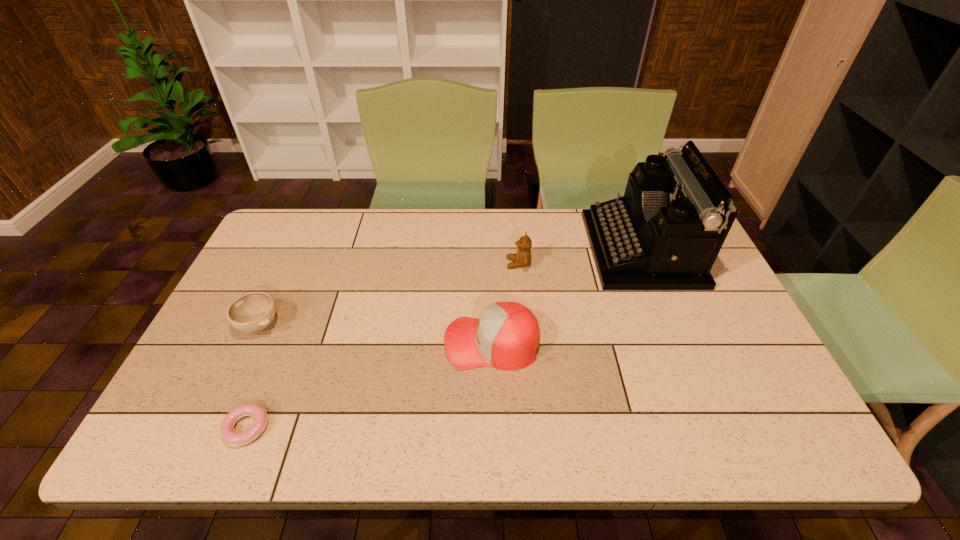
You are a GUI agent. You are given a task and a screenshot of the screen. Output one action in this format:
    pyautogui.click(x=<x>, y=<y>)
    Task: Click on the object that is positioned at the near edge
    
    Given the screenshot: What is the action you would take?
    pyautogui.click(x=228, y=435)

Image resolution: width=960 pixels, height=540 pixels. What are the coordinates of `bowl located in the left edge section of the desktop` in the screenshot? It's located at pyautogui.click(x=252, y=312).

Image resolution: width=960 pixels, height=540 pixels. In order to click on doughnut located in the left edge section of the desktop in this screenshot , I will do `click(228, 435)`.

The width and height of the screenshot is (960, 540). I want to click on object at the right edge, so click(x=665, y=233).

Find the location of `object situated at the near left corner`. object situated at the near left corner is located at coordinates (228, 435).

The width and height of the screenshot is (960, 540). I want to click on object that is positioned at the far right corner, so click(x=665, y=233).

The height and width of the screenshot is (540, 960). In order to click on free region at the far edge in this screenshot , I will do `click(486, 222)`.

The image size is (960, 540). In order to click on vacant region at the near edge of the desktop in this screenshot , I will do `click(325, 430)`.

This screenshot has height=540, width=960. Identify the location of vacant space at the left edge of the desktop. (229, 351).

In order to click on blank space at the far left corner in this screenshot , I will do `click(286, 246)`.